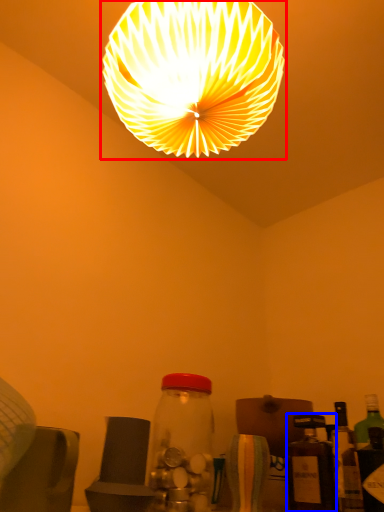
Question: Among these objects, which one is farthest to the camera, lamp (highlighted by a red box) or bottle (highlighted by a blue box)?

Choices:
 (A) lamp
 (B) bottle

Answer: (B)